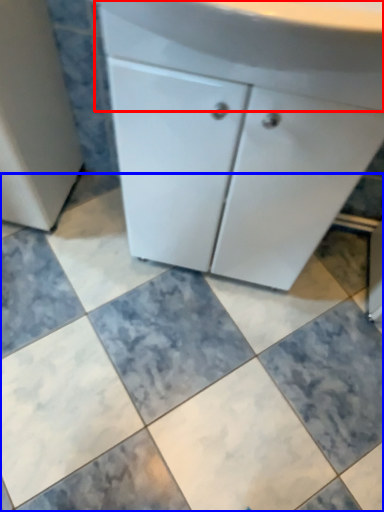
Question: Which object appears farthest to the camera in this image, counter top (highlighted by a red box) or ceramic tile (highlighted by a blue box)?

Choices:
 (A) counter top
 (B) ceramic tile

Answer: (B)